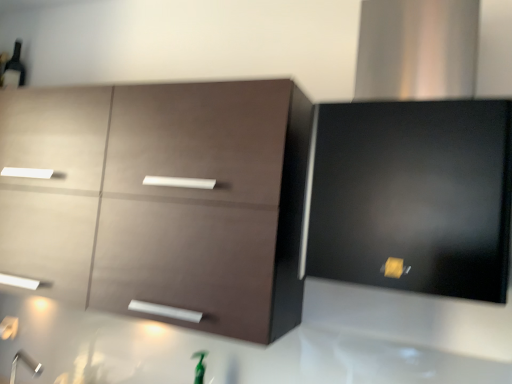
At what (x,y) coordinates should I click in order to perform the action: click on matte black beer bottle at upper left. Please return your answer as a coordinate pair (x, y). This screenshot has height=384, width=512. Looking at the image, I should click on point(14,69).

Identify the location of satin black range hood at upper right, which ranks as the 1th cabinetry in right-to-left order. Image resolution: width=512 pixels, height=384 pixels. (412, 197).

Where is `matte black beer bottle at upper left`? matte black beer bottle at upper left is located at coordinates (14, 69).

Considering the points (444, 146) and (2, 75), which point is in front, point (444, 146) or point (2, 75)?

The point (444, 146) is closer to the camera.

Looking at this image, which object is further away from the camera, satin black range hood at upper right, the 2th cabinetry in the left-to-right sequence, or matte black beer bottle at upper left?

Positioned behind is matte black beer bottle at upper left.

Measure the distance between satin black range hood at upper right, the 2th cabinetry in the left-to-right sequence, and matte black beer bottle at upper left.

satin black range hood at upper right, the 2th cabinetry in the left-to-right sequence, is 5.98 feet from matte black beer bottle at upper left.

Is satin black range hood at upper right, which ranks as the 1th cabinetry in right-to-left order, oriented away from matte black beer bottle at upper left?

That's not correct — satin black range hood at upper right, which ranks as the 1th cabinetry in right-to-left order, is not looking away from matte black beer bottle at upper left.

Is satin black range hood at upper right, the 2th cabinetry in the left-to-right sequence, located outside matte brown cabinet at upper left, marked as the 2th cabinetry in a right-to-left arrangement?

Yes, satin black range hood at upper right, the 2th cabinetry in the left-to-right sequence, is not within matte brown cabinet at upper left, marked as the 2th cabinetry in a right-to-left arrangement.

Is satin black range hood at upper right, which ranks as the 1th cabinetry in right-to-left order, looking in the opposite direction of matte brown cabinet at upper left, the 1th cabinetry from the left?

No, satin black range hood at upper right, which ranks as the 1th cabinetry in right-to-left order,'s orientation is not away from matte brown cabinet at upper left, the 1th cabinetry from the left.

Considering the relative sizes of satin black range hood at upper right, which ranks as the 1th cabinetry in right-to-left order, and matte brown cabinet at upper left, the 1th cabinetry from the left, in the image provided, is satin black range hood at upper right, which ranks as the 1th cabinetry in right-to-left order, thinner than matte brown cabinet at upper left, the 1th cabinetry from the left,?

Incorrect, the width of satin black range hood at upper right, which ranks as the 1th cabinetry in right-to-left order, is not less than that of matte brown cabinet at upper left, the 1th cabinetry from the left.

From the image's perspective, which is below, satin black range hood at upper right, which ranks as the 1th cabinetry in right-to-left order, or matte brown cabinet at upper left, marked as the 2th cabinetry in a right-to-left arrangement?

matte brown cabinet at upper left, marked as the 2th cabinetry in a right-to-left arrangement, is shown below in the image.

Who is shorter, matte black beer bottle at upper left or satin black range hood at upper right, the 2th cabinetry in the left-to-right sequence?

Standing shorter between the two is matte black beer bottle at upper left.

Does matte black beer bottle at upper left have a lesser width compared to satin black range hood at upper right, which ranks as the 1th cabinetry in right-to-left order?

Yes.

Is matte black beer bottle at upper left situated inside satin black range hood at upper right, which ranks as the 1th cabinetry in right-to-left order, or outside?

matte black beer bottle at upper left is outside satin black range hood at upper right, which ranks as the 1th cabinetry in right-to-left order.

Which object is positioned more to the right, matte black beer bottle at upper left or satin black range hood at upper right, which ranks as the 1th cabinetry in right-to-left order?

satin black range hood at upper right, which ranks as the 1th cabinetry in right-to-left order, is more to the right.

Looking at their sizes, would you say matte brown cabinet at upper left, marked as the 2th cabinetry in a right-to-left arrangement, is wider or thinner than satin black range hood at upper right, the 2th cabinetry in the left-to-right sequence?

matte brown cabinet at upper left, marked as the 2th cabinetry in a right-to-left arrangement, is thinner than satin black range hood at upper right, the 2th cabinetry in the left-to-right sequence.

Is satin black range hood at upper right, the 2th cabinetry in the left-to-right sequence, at the back of matte brown cabinet at upper left, the 1th cabinetry from the left?

matte brown cabinet at upper left, the 1th cabinetry from the left, does not have its back to satin black range hood at upper right, the 2th cabinetry in the left-to-right sequence.

Is matte brown cabinet at upper left, the 1th cabinetry from the left, to the right of satin black range hood at upper right, the 2th cabinetry in the left-to-right sequence, from the viewer's perspective?

No.

Measure the distance from matte brown cabinet at upper left, the 1th cabinetry from the left, to satin black range hood at upper right, which ranks as the 1th cabinetry in right-to-left order.

A distance of 17.93 inches exists between matte brown cabinet at upper left, the 1th cabinetry from the left, and satin black range hood at upper right, which ranks as the 1th cabinetry in right-to-left order.

From the matte black beer bottle at upper left, count 1st cabinetry to the right and point to it. Please provide its 2D coordinates.

[(161, 199)]

Considering the positions of objects matte black beer bottle at upper left and matte brown cabinet at upper left, the 1th cabinetry from the left, in the image provided, who is behind, matte black beer bottle at upper left or matte brown cabinet at upper left, the 1th cabinetry from the left,?

matte black beer bottle at upper left is further from the camera.

Is matte black beer bottle at upper left shorter than matte brown cabinet at upper left, marked as the 2th cabinetry in a right-to-left arrangement?

Indeed, matte black beer bottle at upper left has a lesser height compared to matte brown cabinet at upper left, marked as the 2th cabinetry in a right-to-left arrangement.

Between matte black beer bottle at upper left and matte brown cabinet at upper left, the 1th cabinetry from the left, which one appears on the right side from the viewer's perspective?

Positioned to the right is matte brown cabinet at upper left, the 1th cabinetry from the left.

Is matte brown cabinet at upper left, marked as the 2th cabinetry in a right-to-left arrangement, bigger than matte black beer bottle at upper left?

Correct, matte brown cabinet at upper left, marked as the 2th cabinetry in a right-to-left arrangement, is larger in size than matte black beer bottle at upper left.

Is matte brown cabinet at upper left, the 1th cabinetry from the left, looking in the opposite direction of matte black beer bottle at upper left?

No, matte black beer bottle at upper left is not at the back of matte brown cabinet at upper left, the 1th cabinetry from the left.

Image resolution: width=512 pixels, height=384 pixels. I want to click on the 2nd cabinetry below the matte black beer bottle at upper left (from the image's perspective), so click(x=161, y=199).

From the image's perspective, which object appears higher, matte brown cabinet at upper left, marked as the 2th cabinetry in a right-to-left arrangement, or matte black beer bottle at upper left?

matte black beer bottle at upper left.

This screenshot has height=384, width=512. What are the coordinates of `beer bottle above the satin black range hood at upper right, which ranks as the 1th cabinetry in right-to-left order (from a real-world perspective)` in the screenshot? It's located at (14, 69).

You are a GUI agent. You are given a task and a screenshot of the screen. Output one action in this format:
    pyautogui.click(x=<x>, y=<y>)
    Task: Click on the cabinetry that appears in front of the matte brown cabinet at upper left, marked as the 2th cabinetry in a right-to-left arrangement
    The height and width of the screenshot is (384, 512).
    Given the screenshot: What is the action you would take?
    pyautogui.click(x=412, y=197)

When comparing their distances from satin black range hood at upper right, the 2th cabinetry in the left-to-right sequence, does matte brown cabinet at upper left, the 1th cabinetry from the left, or matte black beer bottle at upper left seem further?

matte black beer bottle at upper left.

Estimate the real-world distances between objects in this image. Which object is closer to matte black beer bottle at upper left, matte brown cabinet at upper left, the 1th cabinetry from the left, or satin black range hood at upper right, the 2th cabinetry in the left-to-right sequence?

matte brown cabinet at upper left, the 1th cabinetry from the left, lies closer to matte black beer bottle at upper left than the other object.

Estimate the real-world distances between objects in this image. Which object is further from satin black range hood at upper right, which ranks as the 1th cabinetry in right-to-left order, matte black beer bottle at upper left or matte brown cabinet at upper left, the 1th cabinetry from the left?

matte black beer bottle at upper left lies further to satin black range hood at upper right, which ranks as the 1th cabinetry in right-to-left order, than the other object.

Looking at the image, which one is located closer to matte brown cabinet at upper left, marked as the 2th cabinetry in a right-to-left arrangement, satin black range hood at upper right, the 2th cabinetry in the left-to-right sequence, or matte black beer bottle at upper left?

Among the two, satin black range hood at upper right, the 2th cabinetry in the left-to-right sequence, is located nearer to matte brown cabinet at upper left, marked as the 2th cabinetry in a right-to-left arrangement.

Estimate the real-world distances between objects in this image. Which object is further from matte brown cabinet at upper left, the 1th cabinetry from the left, matte black beer bottle at upper left or satin black range hood at upper right, the 2th cabinetry in the left-to-right sequence?

Based on the image, matte black beer bottle at upper left appears to be further to matte brown cabinet at upper left, the 1th cabinetry from the left.

Which object lies nearer to the anchor point matte black beer bottle at upper left, satin black range hood at upper right, the 2th cabinetry in the left-to-right sequence, or matte brown cabinet at upper left, marked as the 2th cabinetry in a right-to-left arrangement?

matte brown cabinet at upper left, marked as the 2th cabinetry in a right-to-left arrangement, is positioned closer to the anchor matte black beer bottle at upper left.

The width and height of the screenshot is (512, 384). What are the coordinates of `cabinetry between matte black beer bottle at upper left and satin black range hood at upper right, which ranks as the 1th cabinetry in right-to-left order` in the screenshot? It's located at (161, 199).